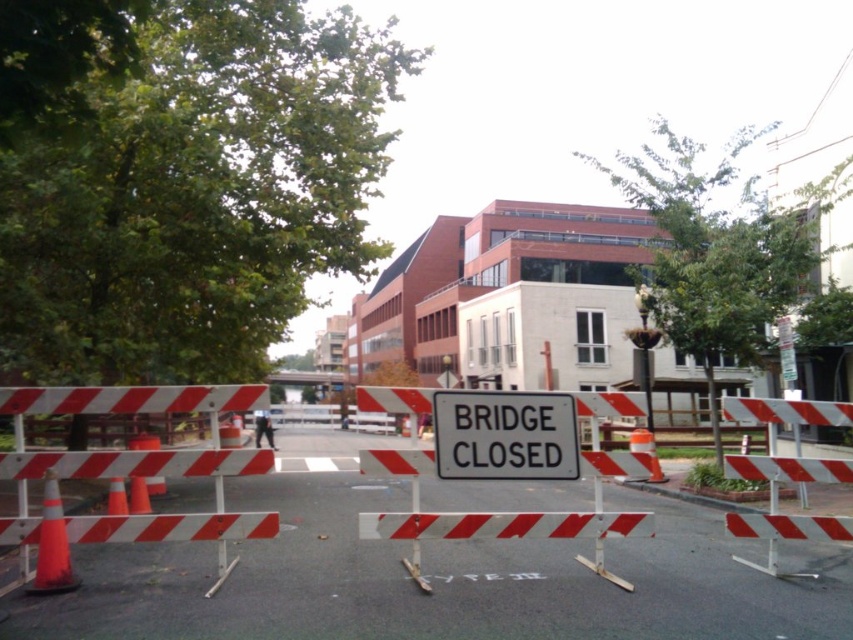
Question: From the image, what is the correct spatial relationship of white striped barricade at center in relation to white metal barricade at center?

Choices:
 (A) left
 (B) right

Answer: (A)

Question: Which is farther from the white plastic sign at center?

Choices:
 (A) white metal barricade at center
 (B) orange reflective cone at center-left
 (C) white striped barricade at center

Answer: (B)

Question: Does white metal barricade at center appear under orange reflective cone at center-left?

Choices:
 (A) no
 (B) yes

Answer: (A)

Question: Which of the following is the farthest from the observer?

Choices:
 (A) [759, 397]
 (B) [62, 552]
 (C) [119, 467]

Answer: (A)

Question: Does white striped barricade at center have a lesser width compared to white plastic sign at center?

Choices:
 (A) no
 (B) yes

Answer: (B)

Question: Among these points, which one is farthest from the camera?

Choices:
 (A) (747, 531)
 (B) (21, 472)
 (C) (61, 548)

Answer: (A)